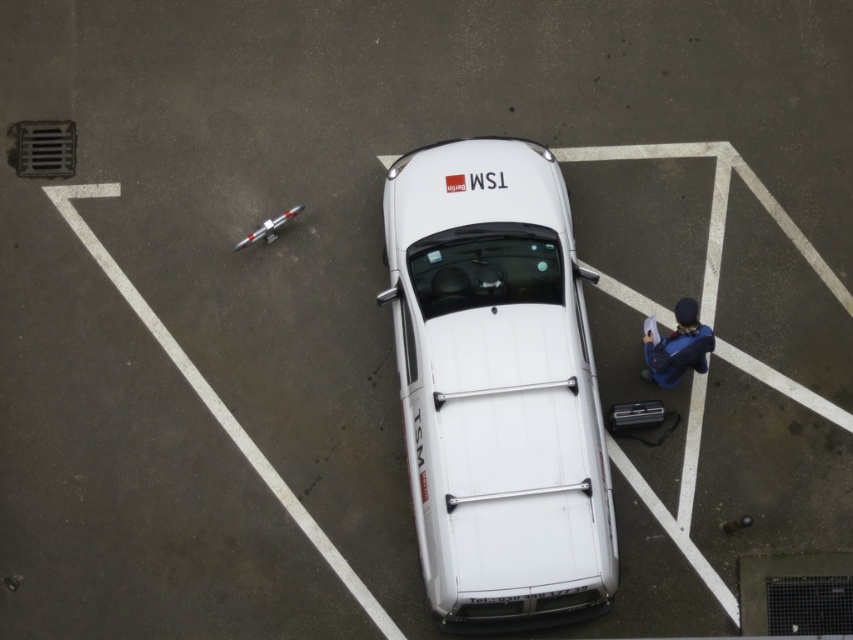
You are standing at the camera position and want to pick up an object. Which point, point (384, 198) or point (651, 380), is closer to you?

Point (384, 198) is closer to the camera than point (651, 380), so you should pick up the object at point (384, 198) first as it is nearer to your current position.

You are a parking attendant who needs to park a new vehicle in this parking lot. The parking space is exactly the width of the white matte van at center. If you have a car that is the same width as the blue fabric jacket at lower right, will it fit in the space?

The white matte van at center is wider than the blue fabric jacket at lower right. Since the parking space is the width of the van, the car with the same width as the jacket will fit as it is narrower.

You are a delivery driver who needs to park your van in the parking lot. The parking lot has a white matte van at center. According to the parking lot rules, vehicles must be parked within 0.5 meters of the center point of their designated parking space. The center point of your designated parking space is at coordinates 0.5, 0.5. Can you park your van within the allowed distance?

The white matte van at center is located at point (497, 387). The distance between this point and the center point (426, 320) is sqrt of squared differences in x and y coordinates. Calculating sqrt of squared differences between 0.606 and 0.5 in x and 0.584 and 0.5 in y. The distance is sqrt of 0.0106 and 0.007056, which sums to sqrt of 0.017656, which is approximately 0.133 meters. Since 0.133 meters is less than 0.5 meters, the van can be parked within the allowed distance.